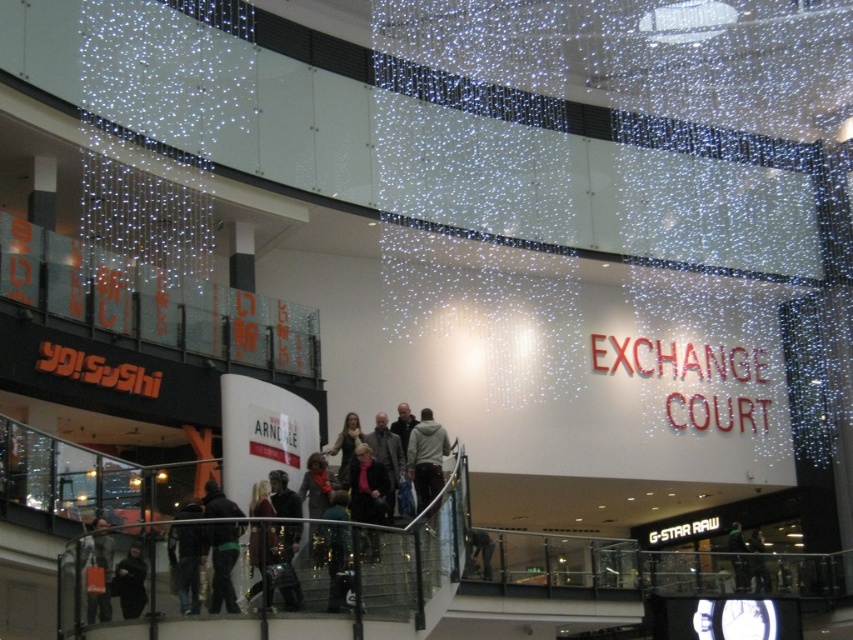
You are standing at the bottom of the staircase in the mall and see both the dark blue jeans at lower center and the dark gray fabric jacket at lower left. Which object is closer to you?

The dark blue jeans at lower center is closer to you because the dark gray fabric jacket at lower left is behind it.

You are standing at the entrance of Exchange Court in the shopping mall. You see dark blue jeans at lower center. Where exactly are they located in terms of coordinates?

The dark blue jeans at lower center are located at point (334, 561).